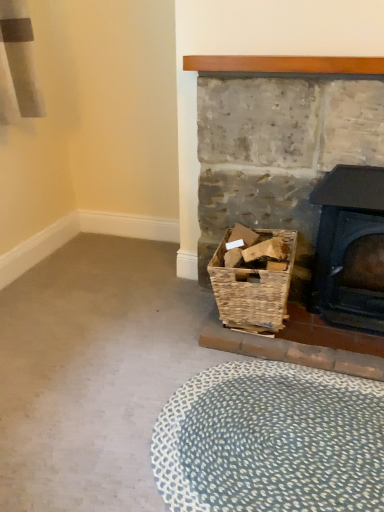
You are a GUI agent. You are given a task and a screenshot of the screen. Output one action in this format:
    pyautogui.click(x=<x>, y=<y>)
    Task: Click on the free spot below blue textured rug at lower center (from a real-world perspective)
    The width and height of the screenshot is (384, 512).
    Given the screenshot: What is the action you would take?
    pyautogui.click(x=266, y=438)